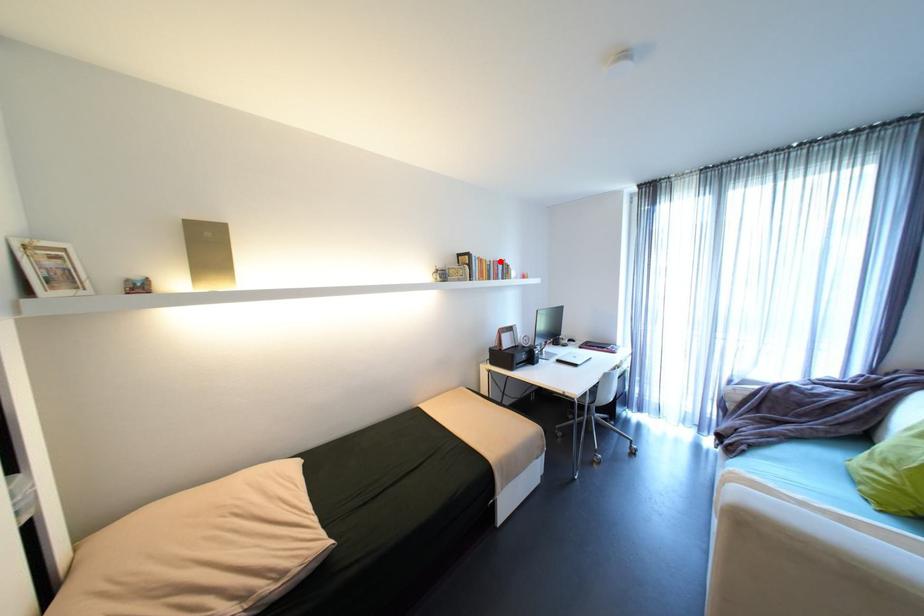
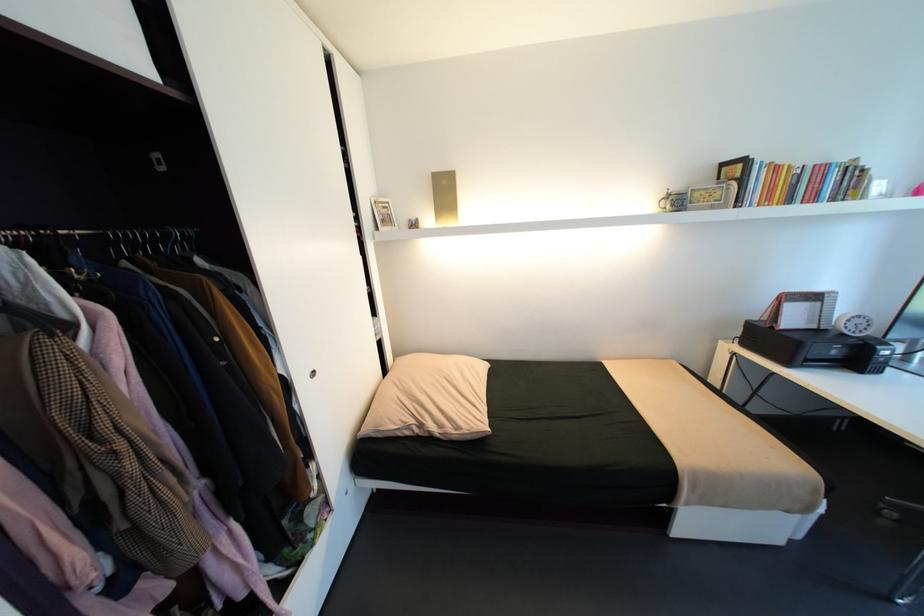
Find the pixel in the second image that matches the highlighted location in the first image.

(821, 166)